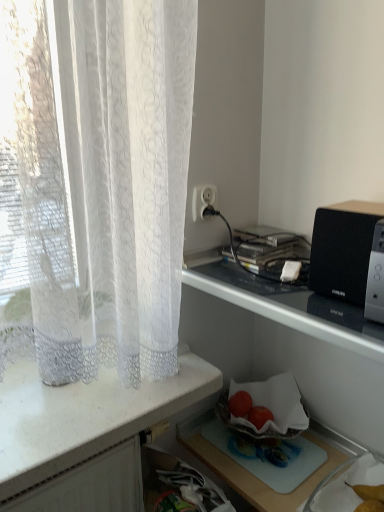
Question: Which direction should I rotate to look at smooth red strawberries at center, which is the second fruit from left to right?

Choices:
 (A) right
 (B) left

Answer: (A)

Question: Is smooth red strawberries at center, which is the second fruit from left to right, surrounding metallic silver microwave at upper right?

Choices:
 (A) yes
 (B) no

Answer: (B)

Question: From the image's perspective, is smooth red strawberries at center, which is the second fruit from left to right, over metallic silver microwave at upper right?

Choices:
 (A) no
 (B) yes

Answer: (B)

Question: Can you confirm if smooth red strawberries at center, the first fruit when ordered from right to left, is thinner than metallic silver microwave at upper right?

Choices:
 (A) yes
 (B) no

Answer: (A)

Question: Is smooth red strawberries at center, the first fruit when ordered from right to left, not within metallic silver microwave at upper right?

Choices:
 (A) no
 (B) yes

Answer: (A)

Question: From a real-world perspective, is smooth red strawberries at center, the first fruit when ordered from right to left, under metallic silver microwave at upper right?

Choices:
 (A) yes
 (B) no

Answer: (B)

Question: Is smooth red strawberries at center, which is the second fruit from left to right, further to the viewer compared to metallic silver microwave at upper right?

Choices:
 (A) yes
 (B) no

Answer: (A)

Question: Does red matte tomato at lower center, marked as the 2th fruit in a right-to-left arrangement, have a larger size compared to black plastic speaker at upper right?

Choices:
 (A) no
 (B) yes

Answer: (A)

Question: Can black plastic speaker at upper right be found inside red matte tomato at lower center, which is the 1th fruit from left to right?

Choices:
 (A) yes
 (B) no

Answer: (B)

Question: Would you consider red matte tomato at lower center, which is the 1th fruit from left to right, to be distant from black plastic speaker at upper right?

Choices:
 (A) yes
 (B) no

Answer: (B)

Question: From the image's perspective, is red matte tomato at lower center, marked as the 2th fruit in a right-to-left arrangement, over black plastic speaker at upper right?

Choices:
 (A) yes
 (B) no

Answer: (B)

Question: Is red matte tomato at lower center, which is the 1th fruit from left to right, positioned before black plastic speaker at upper right?

Choices:
 (A) no
 (B) yes

Answer: (A)

Question: Considering the relative sizes of red matte tomato at lower center, which is the 1th fruit from left to right, and black plastic speaker at upper right in the image provided, is red matte tomato at lower center, which is the 1th fruit from left to right, thinner than black plastic speaker at upper right?

Choices:
 (A) yes
 (B) no

Answer: (A)

Question: Is the surface of white plastic socket at upper center in direct contact with metallic silver microwave at upper right?

Choices:
 (A) yes
 (B) no

Answer: (B)